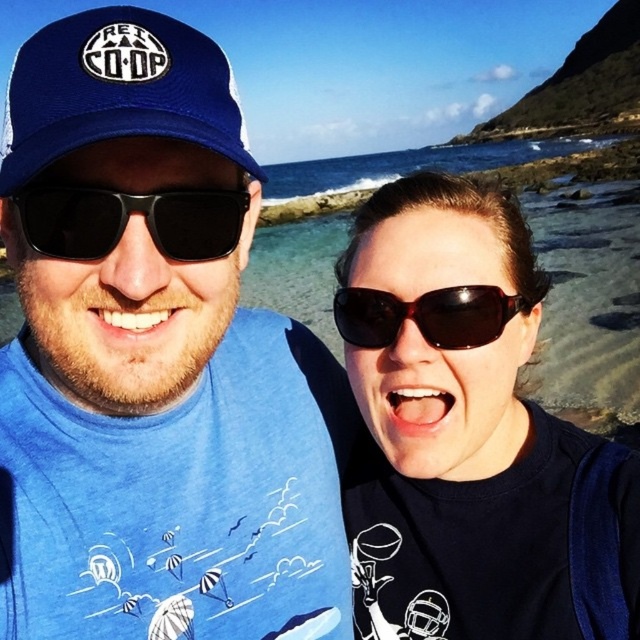
Can you confirm if blue fabric shirt at center is taller than blue fabric baseball cap at upper left?

Yes.

Is point (173, 522) closer to camera compared to point (76, 54)?

No, (173, 522) is behind (76, 54).

This screenshot has height=640, width=640. What do you see at coordinates (154, 360) in the screenshot? I see `blue fabric shirt at center` at bounding box center [154, 360].

The height and width of the screenshot is (640, 640). What are the coordinates of `blue fabric shirt at center` in the screenshot? It's located at (154, 360).

Which of these two, blue fabric shirt at center or matte black sunglasses at center, stands shorter?

matte black sunglasses at center

Based on the photo, which of these two, blue fabric shirt at center or matte black sunglasses at center, stands taller?

With more height is blue fabric shirt at center.

In order to click on blue fabric shirt at center in this screenshot , I will do `click(154, 360)`.

Can you confirm if matte black sunglasses at center is thinner than blue fabric baseball cap at upper left?

Indeed, matte black sunglasses at center has a lesser width compared to blue fabric baseball cap at upper left.

Measure the distance between matte black sunglasses at center and blue fabric baseball cap at upper left.

matte black sunglasses at center and blue fabric baseball cap at upper left are 1.97 meters apart.

Is point (513, 625) farther from camera compared to point (125, 36)?

Yes, point (513, 625) is farther from viewer.

Locate an element on the screen. This screenshot has width=640, height=640. matte black sunglasses at center is located at coordinates click(x=470, y=435).